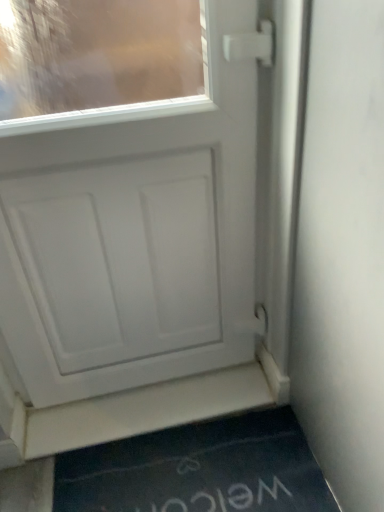
Question: Does dark blue rubber doormat at lower center have a greater width compared to white matte door at center?

Choices:
 (A) yes
 (B) no

Answer: (A)

Question: Is dark blue rubber doormat at lower center turned away from white matte door at center?

Choices:
 (A) yes
 (B) no

Answer: (B)

Question: From the image's perspective, is dark blue rubber doormat at lower center under white matte door at center?

Choices:
 (A) yes
 (B) no

Answer: (A)

Question: Could you tell me if dark blue rubber doormat at lower center is facing white matte door at center?

Choices:
 (A) no
 (B) yes

Answer: (A)

Question: Would you say dark blue rubber doormat at lower center is outside white matte door at center?

Choices:
 (A) no
 (B) yes

Answer: (B)

Question: Is dark blue rubber doormat at lower center at the right side of white matte door at center?

Choices:
 (A) no
 (B) yes

Answer: (B)

Question: Is white matte door at center far away from white matte door at lower center?

Choices:
 (A) no
 (B) yes

Answer: (A)

Question: Is white matte door at center closer to camera compared to white matte door at lower center?

Choices:
 (A) no
 (B) yes

Answer: (B)

Question: Considering the relative sizes of white matte door at center and white matte door at lower center in the image provided, is white matte door at center shorter than white matte door at lower center?

Choices:
 (A) no
 (B) yes

Answer: (A)

Question: Does white matte door at center have a smaller size compared to white matte door at lower center?

Choices:
 (A) yes
 (B) no

Answer: (B)

Question: Is white matte door at center surrounding white matte door at lower center?

Choices:
 (A) yes
 (B) no

Answer: (B)

Question: From the image's perspective, would you say white matte door at center is positioned over white matte door at lower center?

Choices:
 (A) yes
 (B) no

Answer: (A)

Question: Can you confirm if white matte door at lower center is smaller than white matte door at center?

Choices:
 (A) yes
 (B) no

Answer: (A)